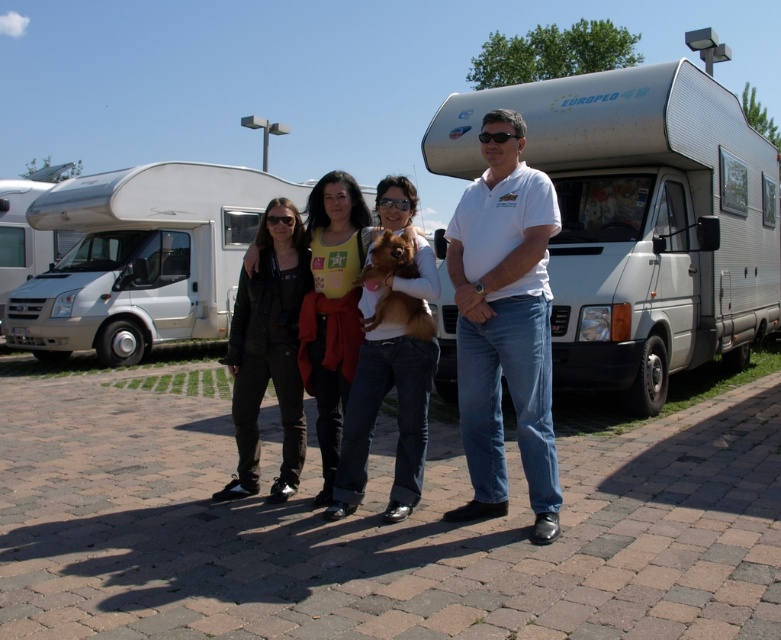
Is dark brown leather jacket at center to the right of yellow-green fabric shirt at center from the viewer's perspective?

No, dark brown leather jacket at center is not to the right of yellow-green fabric shirt at center.

Is dark brown leather jacket at center thinner than yellow-green fabric shirt at center?

No.

I want to click on dark brown leather jacket at center, so click(x=268, y=349).

Who is more forward, (319, 426) or (419, 323)?

Point (419, 323)

Between yellow-green fabric shirt at center and brown furry dog at center, which one is positioned higher?

yellow-green fabric shirt at center

Is point (355, 259) farther from viewer compared to point (409, 264)?

Yes, it is.

You are a GUI agent. You are given a task and a screenshot of the screen. Output one action in this format:
    pyautogui.click(x=<x>, y=<y>)
    Task: Click on the yellow-green fabric shirt at center
    Image resolution: width=781 pixels, height=640 pixels.
    Given the screenshot: What is the action you would take?
    pyautogui.click(x=332, y=308)

Can you confirm if yellow-green fabric shirt at center is wider than white glossy recreational vehicle at left?

No.

Can you confirm if yellow-green fabric shirt at center is positioned above white glossy recreational vehicle at left?

Incorrect, yellow-green fabric shirt at center is not positioned above white glossy recreational vehicle at left.

Describe the element at coordinates (332, 308) in the screenshot. I see `yellow-green fabric shirt at center` at that location.

Where is `yellow-green fabric shirt at center`? yellow-green fabric shirt at center is located at coordinates (332, 308).